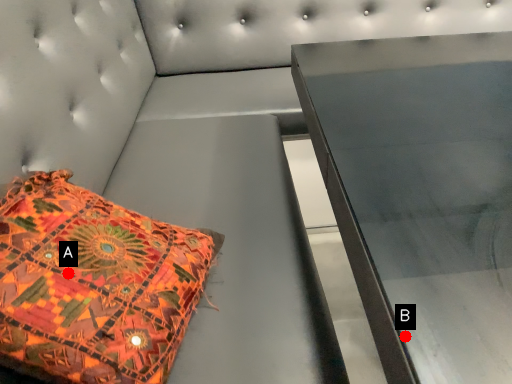
Question: Two points are circled on the image, labeled by A and B beside each circle. Which point is closer to the camera taking this photo?

Choices:
 (A) A is closer
 (B) B is closer

Answer: (B)